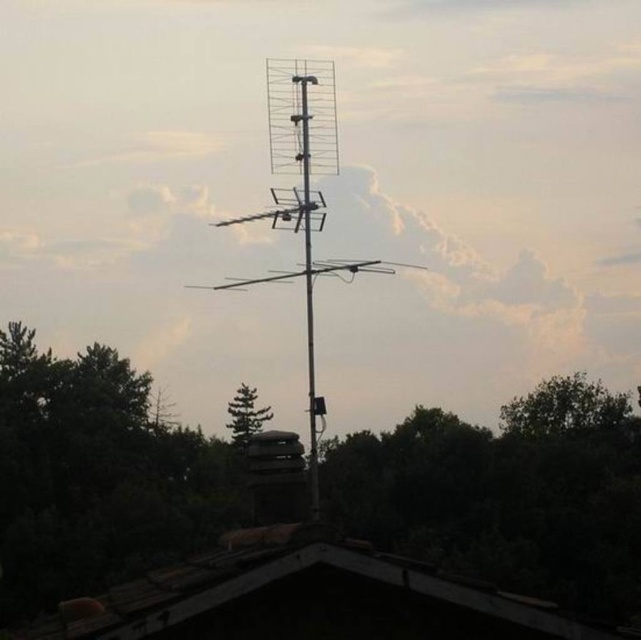
Can you confirm if green leafy tree at center is positioned above brown wooden roof at lower center?

No, green leafy tree at center is not above brown wooden roof at lower center.

Where is `green leafy tree at center`? green leafy tree at center is located at coordinates point(506,493).

Can you confirm if green leafy tree at center is taller than metallic antenna at center?

No.

Is green leafy tree at center further to camera compared to metallic antenna at center?

Yes.

Where is `green leafy tree at center`? green leafy tree at center is located at coordinates (506, 493).

Is point (146, 461) positioned in front of point (226, 426)?

Yes, it is in front of point (226, 426).

Who is more forward, (387, 440) or (260, 429)?

Positioned in front is point (387, 440).

Between point (551, 426) and point (229, 404), which one is positioned in front?

Point (551, 426)

The height and width of the screenshot is (640, 641). In order to click on green leafy tree at center in this screenshot , I will do `click(506, 493)`.